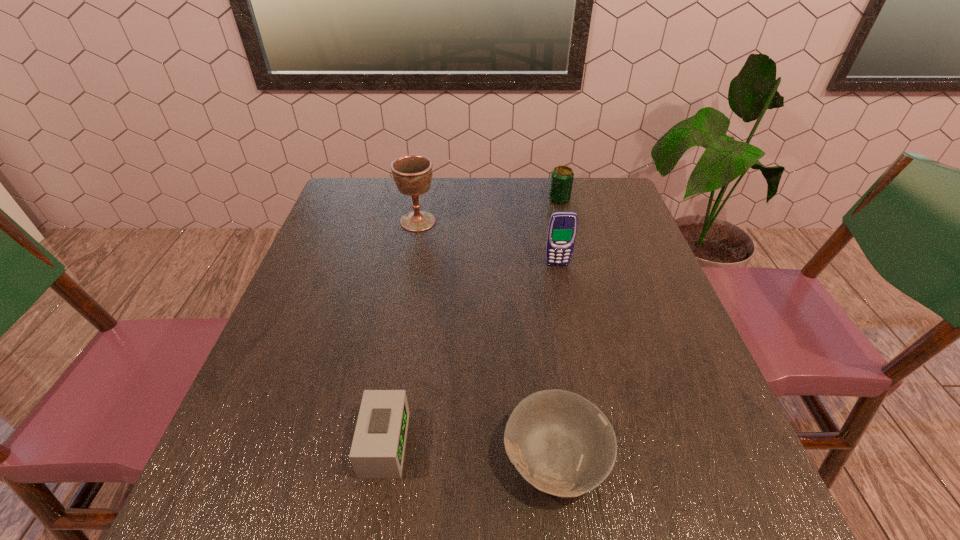
The height and width of the screenshot is (540, 960). What are the coordinates of `the second farthest object` in the screenshot? It's located at (412, 174).

I want to click on the third nearest object, so click(562, 228).

At what (x,y) coordinates should I click in order to perform the action: click on the farthest object. Please return your answer as a coordinate pair (x, y). Looking at the image, I should click on (562, 177).

You are a GUI agent. You are given a task and a screenshot of the screen. Output one action in this format:
    pyautogui.click(x=<x>, y=<y>)
    Task: Click on the third shortest object
    The image size is (960, 540).
    Given the screenshot: What is the action you would take?
    pyautogui.click(x=562, y=177)

At what (x,y) coordinates should I click in order to perform the action: click on alarm clock. Please return your answer as a coordinate pair (x, y). The image size is (960, 540). Looking at the image, I should click on (377, 452).

This screenshot has height=540, width=960. What are the coordinates of `the shortest object` in the screenshot? It's located at (562, 444).

The height and width of the screenshot is (540, 960). In order to click on vacant area situated 0.150m on the left of the second farthest object in this screenshot , I will do `click(346, 221)`.

The image size is (960, 540). Find the location of `vacant position located 0.080m on the front-facing side of the cellular telephone`. vacant position located 0.080m on the front-facing side of the cellular telephone is located at coordinates (562, 289).

Image resolution: width=960 pixels, height=540 pixels. In order to click on free point located on the left of the third shortest object in this screenshot , I will do 420,199.

Locate an element on the screen. This screenshot has height=540, width=960. free space located on the front-facing side of the alarm clock is located at coordinates (465, 444).